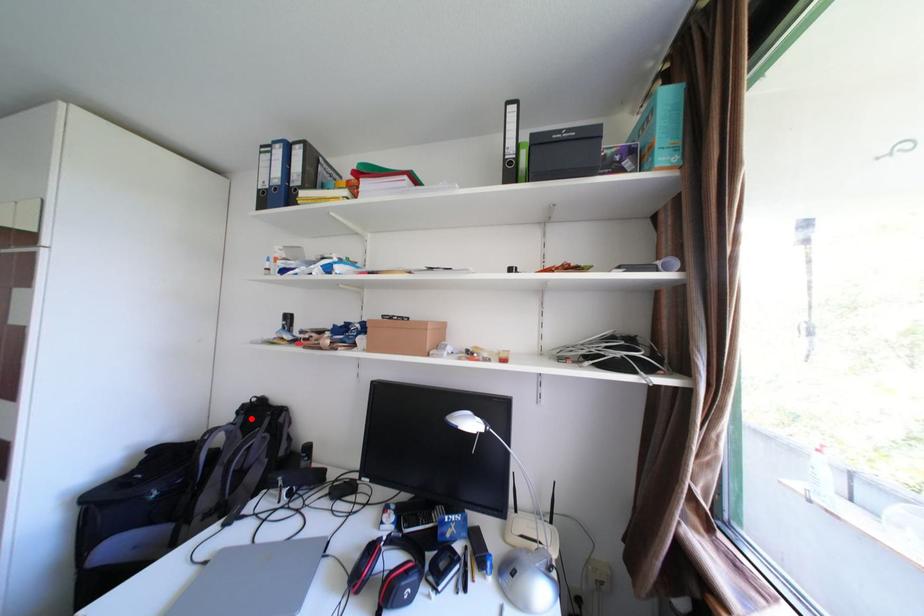
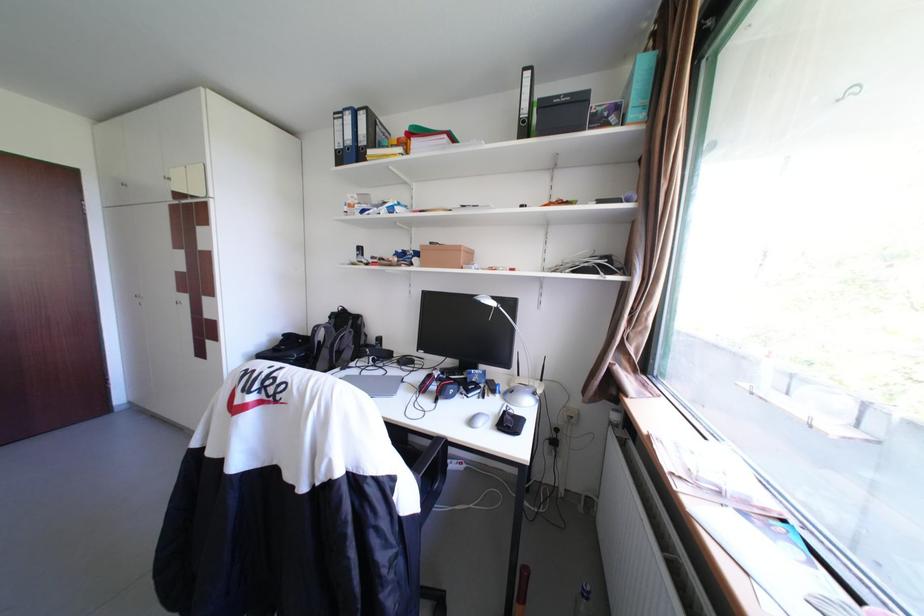
Find the pixel in the second image that matches the highlighted location in the first image.

(344, 321)